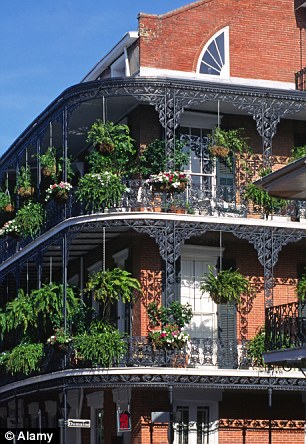
Locate an element on the screen. brick wall is located at coordinates (272, 42), (281, 145), (281, 285), (286, 411).